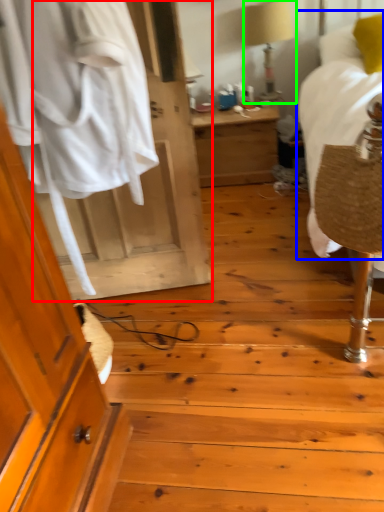
Question: Which is farther away from door (highlighted by a red box)? bed (highlighted by a blue box) or table lamp (highlighted by a green box)?

Choices:
 (A) bed
 (B) table lamp

Answer: (B)